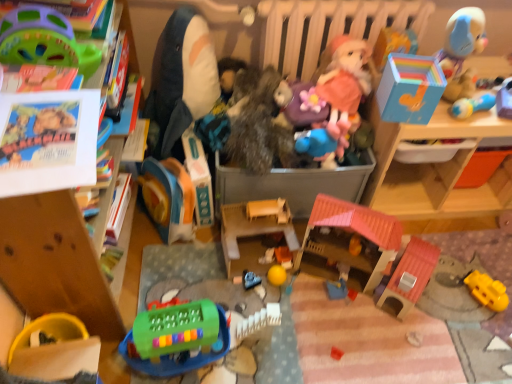
I want to click on vacant space that is to the left of yellow rubber ball at center, the ninth toy when ordered from left to right, so click(x=228, y=279).